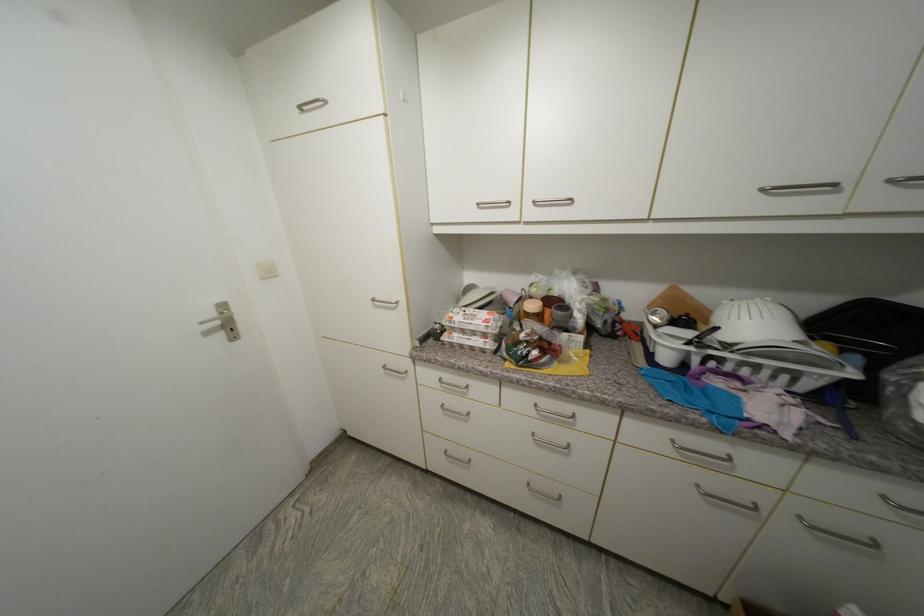
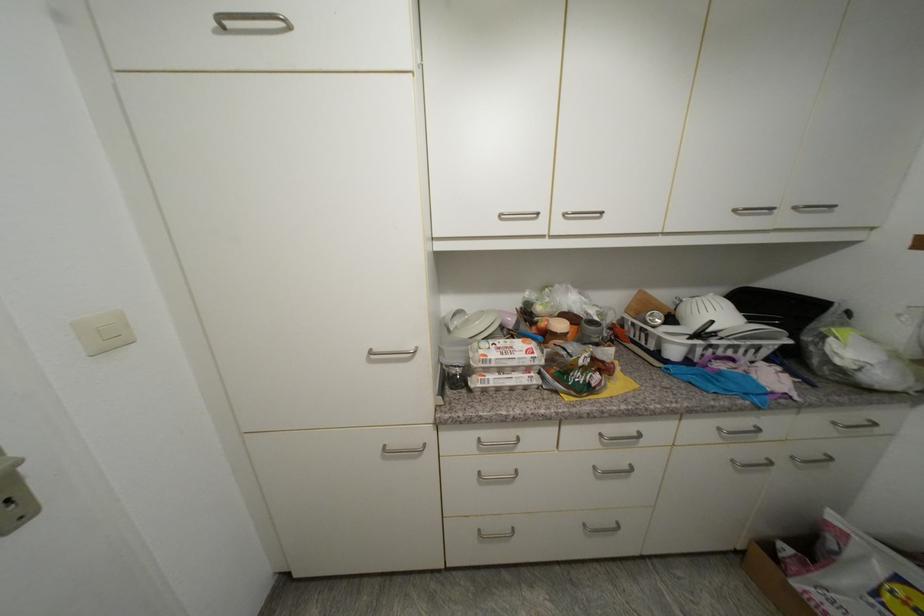
Find the pixel in the second image that matches (x=896, y=183) in the first image.

(800, 209)